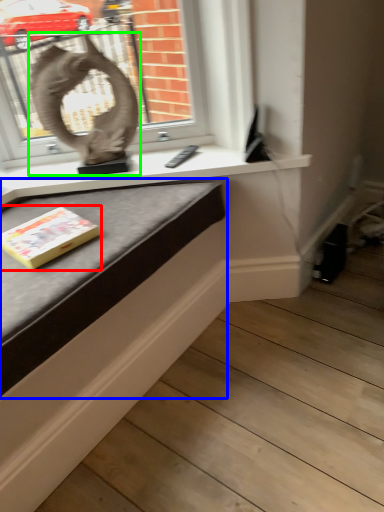
Question: Which object is the closest to the paperback book (highlighted by a red box)? Choose among these: table (highlighted by a blue box) or sculpture (highlighted by a green box).

Choices:
 (A) table
 (B) sculpture

Answer: (A)